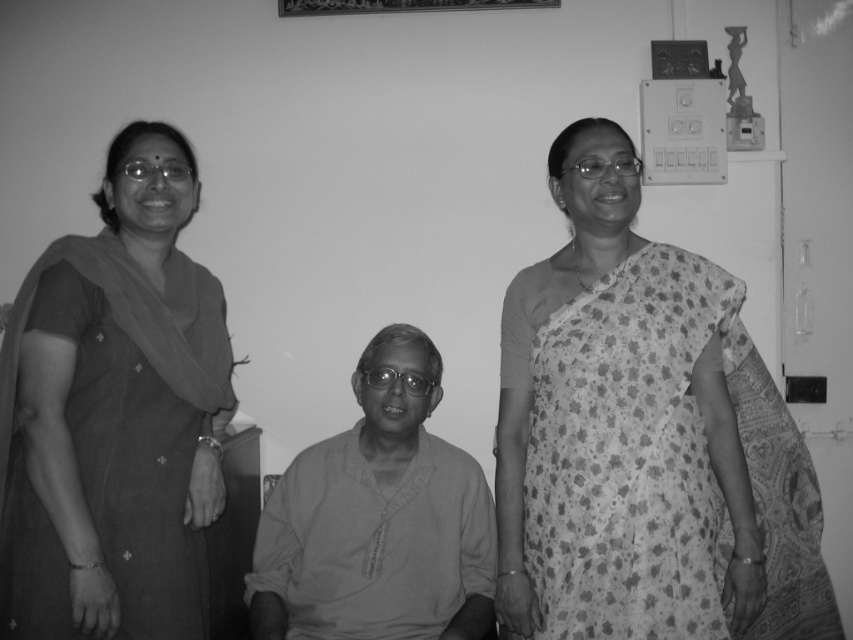
Consider the image. You are organizing a fashion show and need to arrange the printed cotton saree at right and the matte black saree at left based on their positions in the image. Which saree should be placed first in the order from top to bottom?

The matte black saree at left should be placed first in the order from top to bottom because the printed cotton saree at right is positioned below it.

You are an interior designer planning to hang a new clock between the metallic rectangular frame at upper center and the metallic picture frame at upper right. Given that the clock requires 18 inches of space between its edges and the existing frames, will there be enough space?

The metallic rectangular frame at upper center and metallic picture frame at upper right are 21.05 inches apart. Since the required space is 18 inches, there is sufficient space to hang the clock between them.

You are a fashion designer observing the scene. You notice the printed cotton saree at right and the matte black saree at left. Which saree is located to the right of the other?

The printed cotton saree at right is positioned on the right side of matte black saree at left.